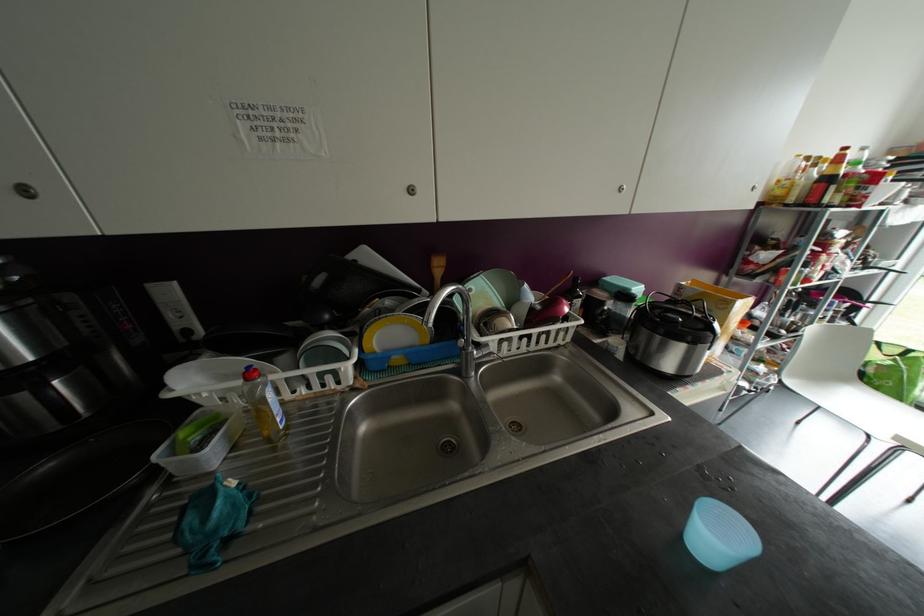
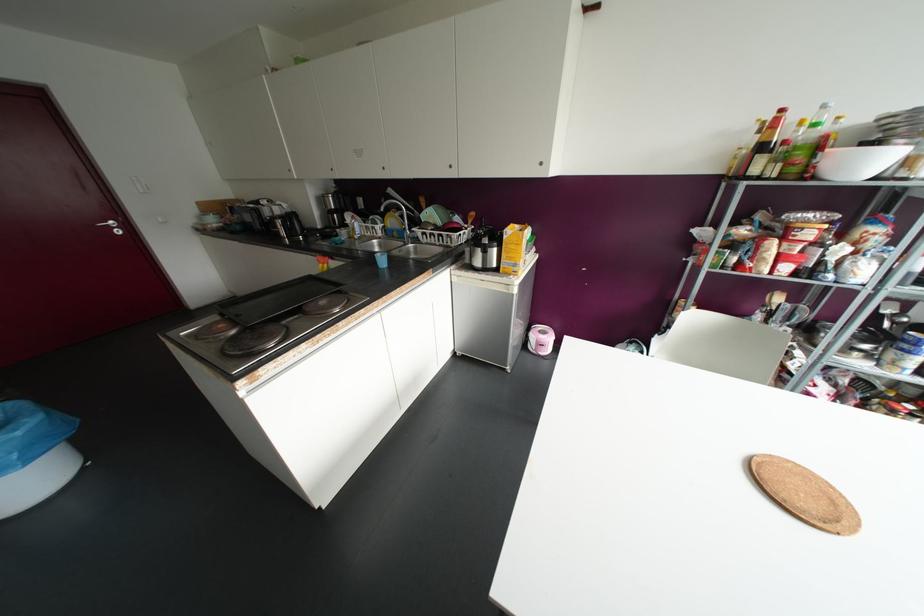
Find the pixel in the second image that matches [864,148] in the first image.

(823, 106)